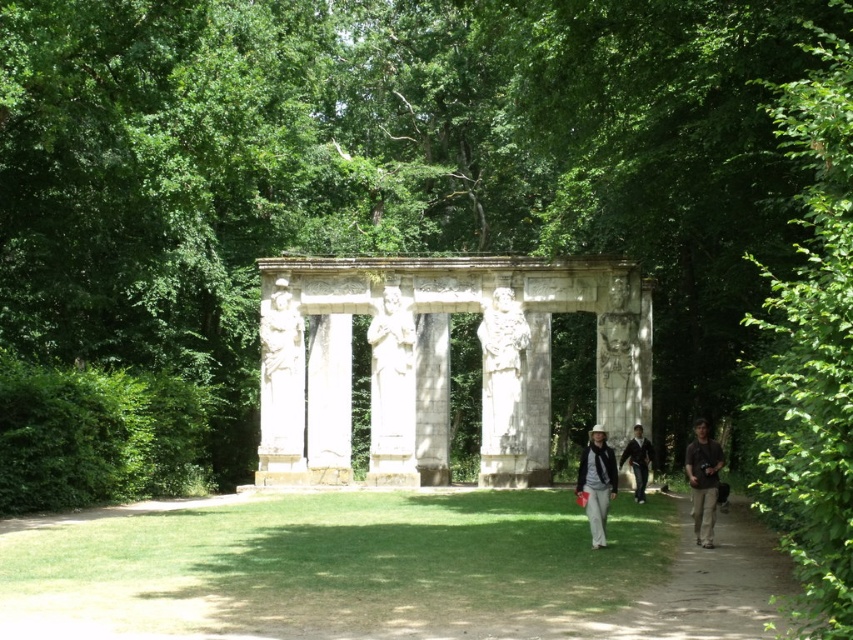
How far apart are white stone gazebo at center and green leafy tree at right?

31.07 meters

This screenshot has height=640, width=853. What are the coordinates of `white stone gazebo at center` in the screenshot? It's located at (436, 362).

Can you confirm if white stone gazebo at center is taller than dark blue jeans at center?

Correct, white stone gazebo at center is much taller as dark blue jeans at center.

The height and width of the screenshot is (640, 853). What are the coordinates of `white stone gazebo at center` in the screenshot? It's located at (436, 362).

From the picture: Who is higher up, white stone gazebo at center or matte black jacket at center?

white stone gazebo at center is above.

Which is below, white stone gazebo at center or matte black jacket at center?

Positioned lower is matte black jacket at center.

Image resolution: width=853 pixels, height=640 pixels. Identify the location of white stone gazebo at center. (436, 362).

The width and height of the screenshot is (853, 640). In order to click on white stone gazebo at center in this screenshot , I will do `click(436, 362)`.